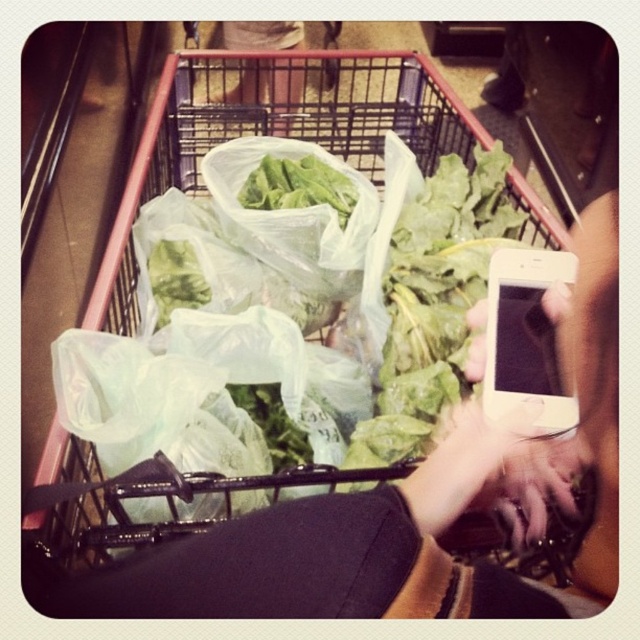
Does clear plastic shopping cart at center appear over green leafy lettuce at center?

Indeed, clear plastic shopping cart at center is positioned over green leafy lettuce at center.

Does point (420, 76) come farther from viewer compared to point (348, 204)?

Yes, it is.

Where is `clear plastic shopping cart at center`? The width and height of the screenshot is (640, 640). clear plastic shopping cart at center is located at coordinates (300, 138).

Does clear plastic shopping cart at center appear under matte plastic pants at center?

Correct, clear plastic shopping cart at center is located below matte plastic pants at center.

Is point (88, 451) positioned in front of point (276, 42)?

Yes.

Where is `clear plastic shopping cart at center`? The height and width of the screenshot is (640, 640). clear plastic shopping cart at center is located at coordinates (300, 138).

Is matte plastic pants at center thinner than green leafy lettuce at center?

Incorrect, matte plastic pants at center's width is not less than green leafy lettuce at center's.

Does matte plastic pants at center appear on the left side of green leafy lettuce at center?

Correct, you'll find matte plastic pants at center to the left of green leafy lettuce at center.

Does point (301, 61) come closer to viewer compared to point (340, 188)?

No.

At what (x,y) coordinates should I click in order to perform the action: click on matte plastic pants at center. Please return your answer as a coordinate pair (x, y). Image resolution: width=640 pixels, height=640 pixels. Looking at the image, I should click on (269, 88).